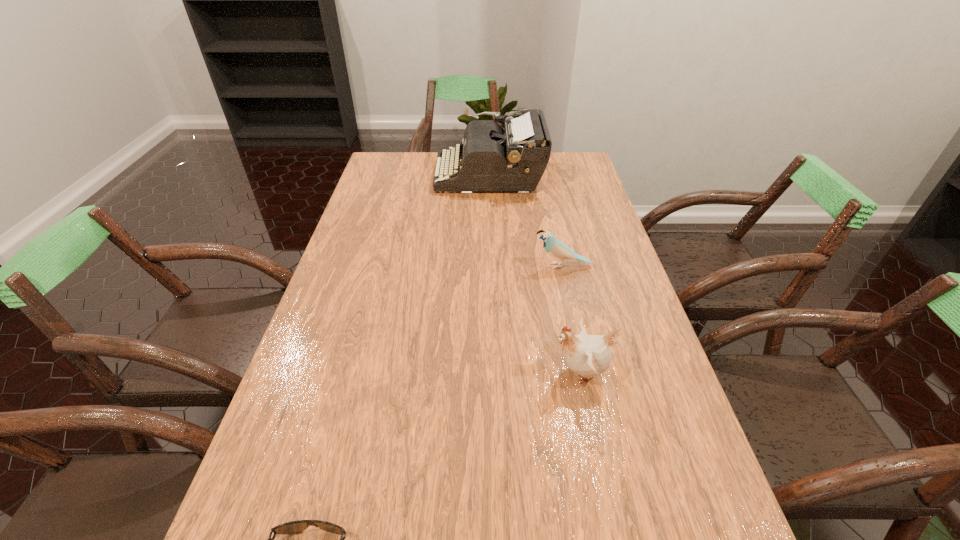
Find the location of `typewriter`. typewriter is located at coordinates (493, 159).

Identify the location of the farthest object. (493, 159).

Find the location of a particular element. The height and width of the screenshot is (540, 960). the taller bird is located at coordinates (587, 355).

Locate an element on the screen. The image size is (960, 540). the third farthest object is located at coordinates (587, 355).

Locate an element on the screen. Image resolution: width=960 pixels, height=540 pixels. the third nearest object is located at coordinates (557, 249).

Locate an element on the screen. The height and width of the screenshot is (540, 960). the third tallest object is located at coordinates (557, 249).

Where is `vacant area located on the front-facing side of the farthest object`? vacant area located on the front-facing side of the farthest object is located at coordinates (418, 174).

Where is `free space located 0.220m on the front-facing side of the farthest object`? The height and width of the screenshot is (540, 960). free space located 0.220m on the front-facing side of the farthest object is located at coordinates (377, 174).

At what (x,y) coordinates should I click in order to perform the action: click on vacant space located on the front-facing side of the farthest object. Please return your answer as a coordinate pair (x, y). This screenshot has height=540, width=960. Looking at the image, I should click on (380, 174).

I want to click on vacant position located 0.080m at the beak of the nearer bird, so click(x=515, y=373).